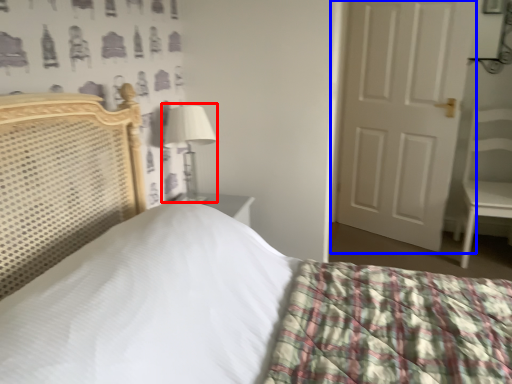
Question: Among these objects, which one is nearest to the camera, table lamp (highlighted by a red box) or door (highlighted by a blue box)?

Choices:
 (A) table lamp
 (B) door

Answer: (A)